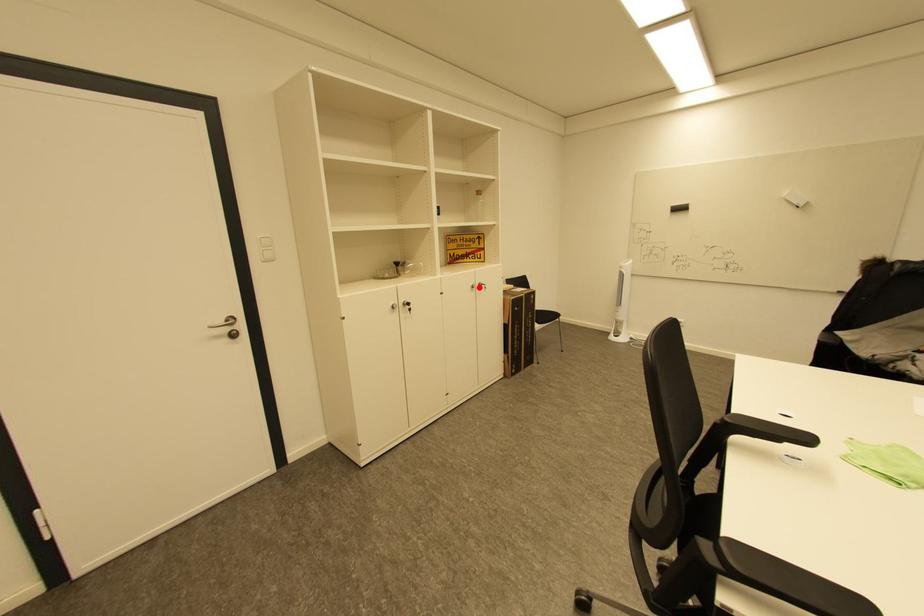
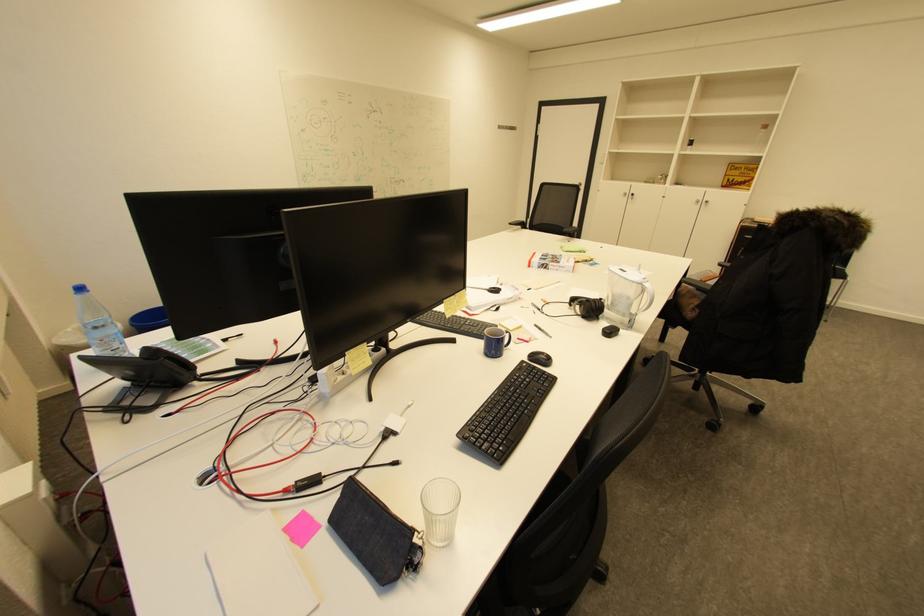
The point at the highlighted location is marked in the first image. Where is the corresponding point in the second image?

(703, 201)